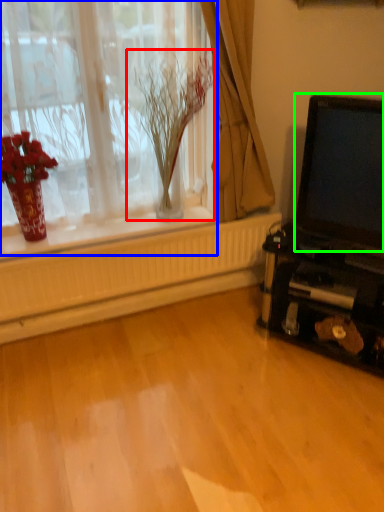
Question: Based on their relative distances, which object is nearer to plant (highlighted by a red box)? Choose from window (highlighted by a blue box) and laptop (highlighted by a green box).

Choices:
 (A) window
 (B) laptop

Answer: (A)